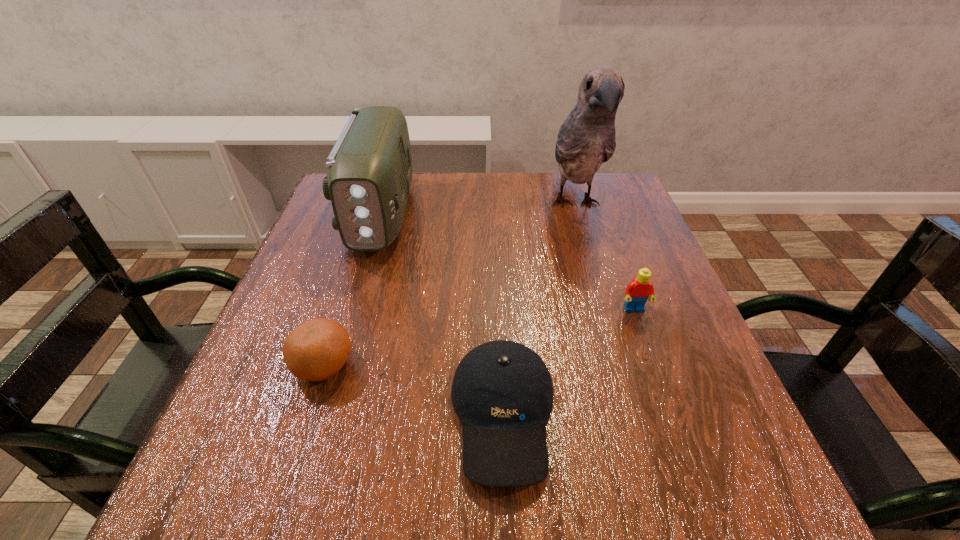
Identify the location of radio_receiver that is at the far edge. The image size is (960, 540). (369, 175).

Locate an element on the screen. object present at the near edge is located at coordinates (502, 392).

The width and height of the screenshot is (960, 540). Find the location of `radio_receiver at the left edge`. radio_receiver at the left edge is located at coordinates (369, 175).

What are the coordinates of `clementine positioned at the left edge` in the screenshot? It's located at (316, 350).

Locate an element on the screen. The width and height of the screenshot is (960, 540). parrot positioned at the right edge is located at coordinates (586, 139).

The width and height of the screenshot is (960, 540). Find the location of `Lego present at the right edge`. Lego present at the right edge is located at coordinates (637, 292).

This screenshot has width=960, height=540. In order to click on object that is at the far left corner in this screenshot , I will do `click(369, 175)`.

Locate an element on the screen. The height and width of the screenshot is (540, 960). object that is at the far right corner is located at coordinates (x=586, y=139).

The height and width of the screenshot is (540, 960). In the image, there is a desktop. In order to click on vacant area at the far edge in this screenshot , I will do (526, 179).

This screenshot has height=540, width=960. I want to click on free spot at the near edge of the desktop, so click(x=523, y=510).